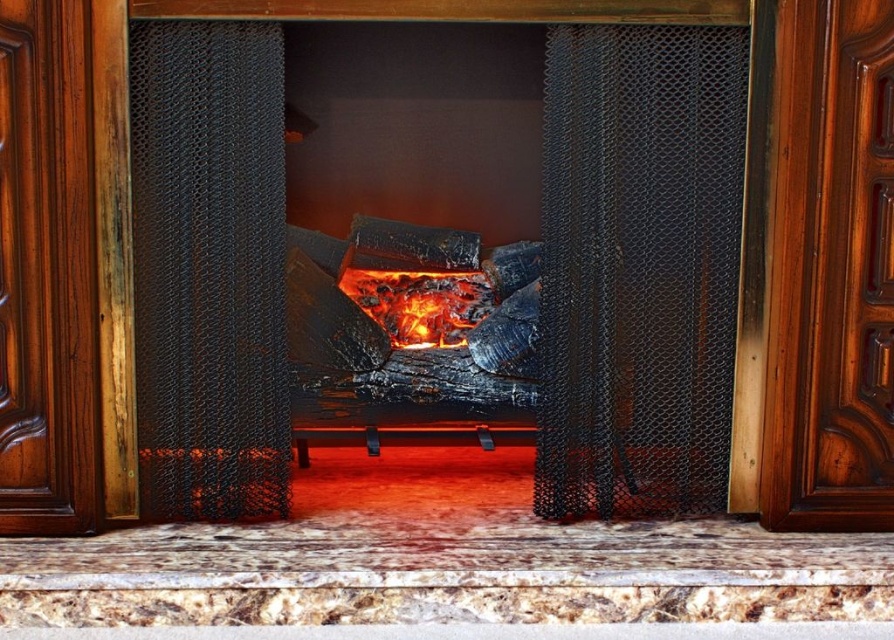
Which is more to the right, black mesh screen at center or glowing embers at center?

Positioned to the right is black mesh screen at center.

Is black mesh screen at center above glowing embers at center?

Yes.

What are the coordinates of `black mesh screen at center` in the screenshot? It's located at (639, 268).

What are the coordinates of `black mesh screen at center` in the screenshot? It's located at (639, 268).

Which is behind, point (204, 422) or point (456, 276)?

The point (456, 276) is more distant.

Can you confirm if metal mesh screen at center is positioned below glowing embers at center?

Incorrect, metal mesh screen at center is not positioned below glowing embers at center.

Who is more forward, (218, 355) or (478, 314)?

Point (218, 355) is more forward.

The width and height of the screenshot is (894, 640). I want to click on metal mesh screen at center, so click(208, 268).

Where is `black mesh screen at center`? The height and width of the screenshot is (640, 894). black mesh screen at center is located at coordinates (639, 268).

Does black mesh screen at center have a greater width compared to metal mesh screen at center?

Indeed, black mesh screen at center has a greater width compared to metal mesh screen at center.

Measure the distance between point (724, 371) and camera.

Point (724, 371) and camera are 2.91 meters apart from each other.

Find the location of a particular element. The width and height of the screenshot is (894, 640). black mesh screen at center is located at coordinates (639, 268).